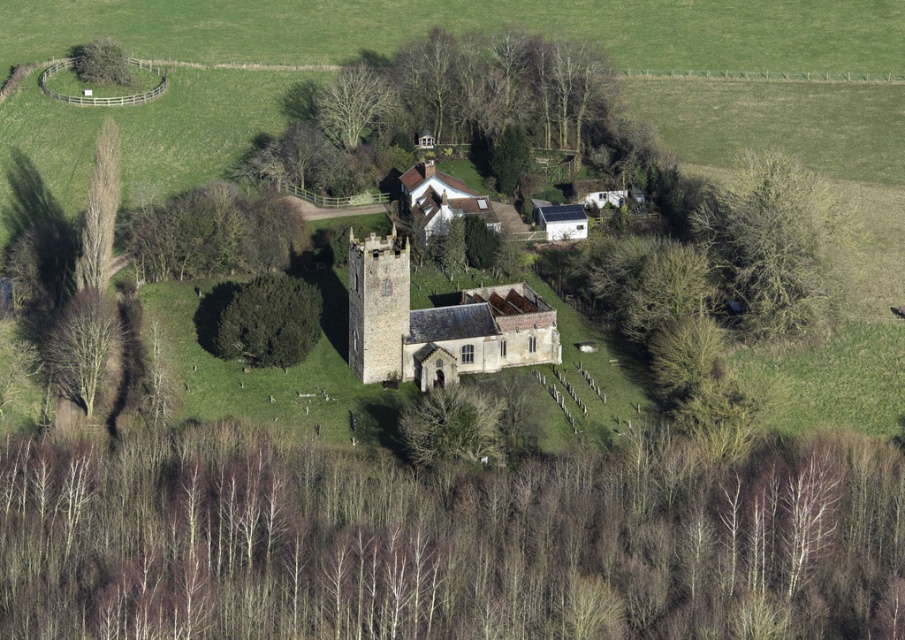
Question: Among these points, which one is nearest to the camera?

Choices:
 (A) (117, 188)
 (B) (350, 109)
 (C) (773, 264)
 (D) (216, 221)

Answer: (C)

Question: Can you confirm if bare wood at left is bigger than green leafy tree at upper left?

Choices:
 (A) no
 (B) yes

Answer: (B)

Question: Which of these objects is positioned closest to the green leafy tree at left?

Choices:
 (A) green leafy bush at right
 (B) green leafy bush at left
 (C) green leafy bush at center
 (D) bare wood at left

Answer: (B)

Question: Which point is closer to the camera?

Choices:
 (A) green leafy tree at upper left
 (B) green leafy bush at right
 (C) bare wood at left

Answer: (C)

Question: Where is bare wood trees at bottom located in relation to green leafy bush at right in the image?

Choices:
 (A) left
 (B) right

Answer: (A)

Question: Does stone church at center appear on the left side of green leafy tree at left?

Choices:
 (A) yes
 (B) no

Answer: (B)